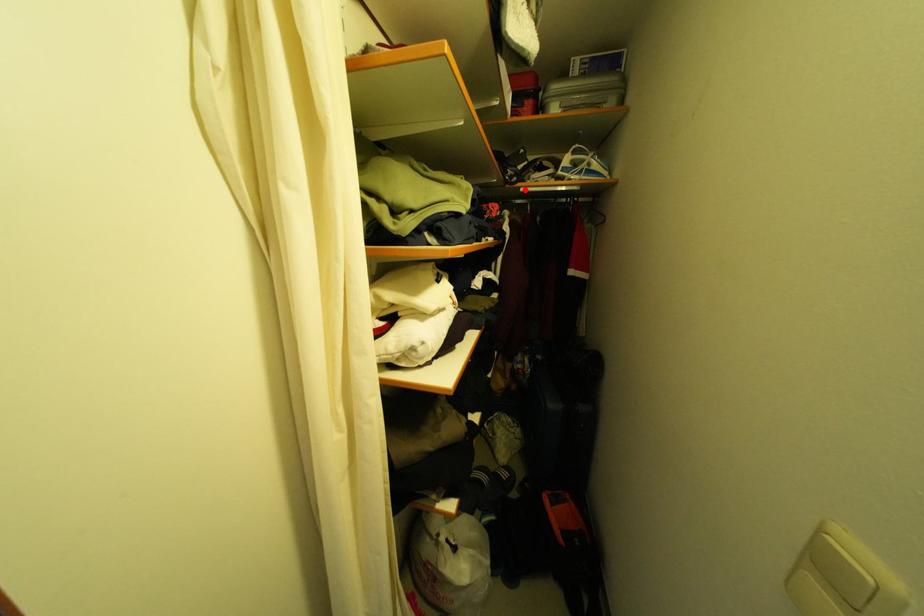
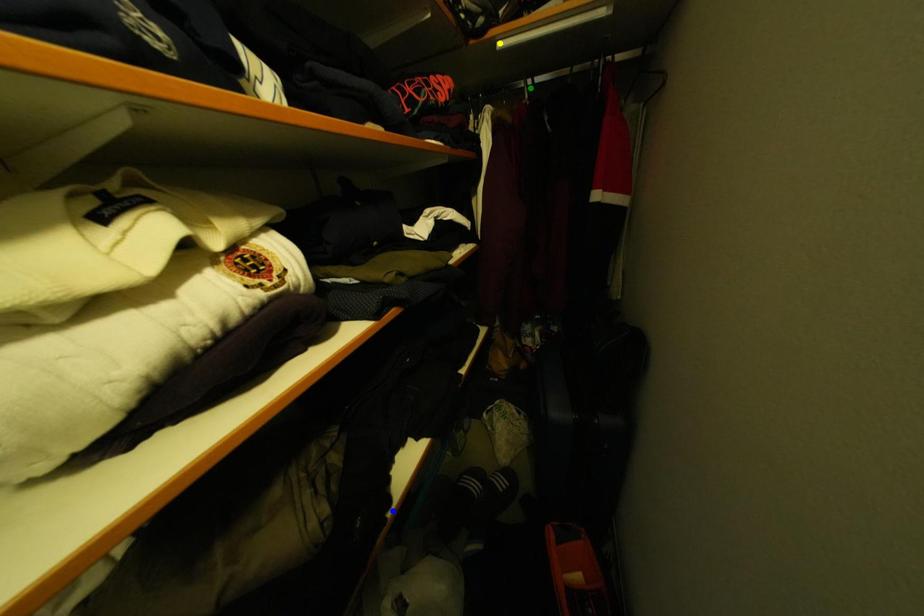
Question: I am providing you with two images of the same scene from different viewpoints. A red point is marked on the first image. You are given multiple points on the second image. Which spot in image 2 lines up with the point in image 1?

Choices:
 (A) yellow point
 (B) blue point
 (C) green point

Answer: (A)